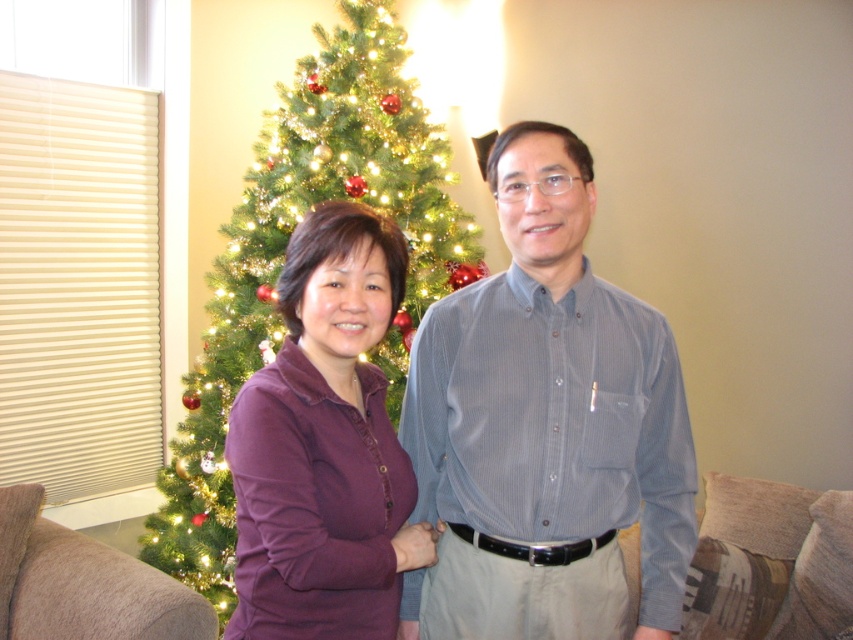
Between point (473, 227) and point (378, 468), which one is positioned in front?

Point (378, 468) is more forward.

Between green textured christmas tree at center and purple cotton shirt at center, which one is positioned lower?

purple cotton shirt at center is lower down.

Identify the location of green textured christmas tree at center. (283, 256).

What are the coordinates of `green textured christmas tree at center` in the screenshot? It's located at (283, 256).

Does blue striped shirt at center appear under purple cotton shirt at center?

Actually, blue striped shirt at center is above purple cotton shirt at center.

Which is behind, point (635, 355) or point (354, 332)?

The point (635, 355) is more distant.

Image resolution: width=853 pixels, height=640 pixels. Find the location of `blue striped shirt at center`. blue striped shirt at center is located at coordinates (544, 428).

Can you confirm if blue striped shirt at center is smaller than green textured christmas tree at center?

Indeed, blue striped shirt at center has a smaller size compared to green textured christmas tree at center.

Can you confirm if blue striped shirt at center is positioned to the left of green textured christmas tree at center?

No, blue striped shirt at center is not to the left of green textured christmas tree at center.

Which is in front, point (434, 465) or point (416, 218)?

Point (434, 465)

Find the location of a particular element. blue striped shirt at center is located at coordinates (544, 428).